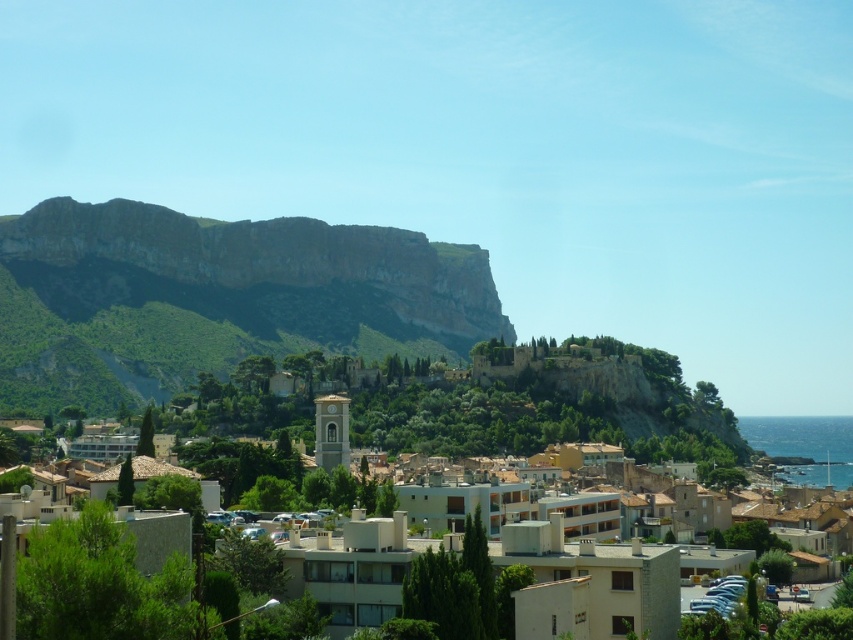
Who is shorter, beige stone town at center or smooth stone bell tower at center?

With less height is smooth stone bell tower at center.

Who is positioned more to the left, beige stone town at center or smooth stone bell tower at center?

smooth stone bell tower at center

At what (x,y) coordinates should I click in order to perform the action: click on beige stone town at center. Please return your answer as a coordinate pair (x, y). The height and width of the screenshot is (640, 853). Looking at the image, I should click on (590, 582).

Does rugged stone cliff at left have a larger size compared to beige stone town at center?

Yes.

Is point (228, 221) positioned behind point (355, 573)?

Yes.

The height and width of the screenshot is (640, 853). In order to click on rugged stone cliff at left in this screenshot , I will do `click(213, 298)`.

Can you confirm if rugged stone cliff at left is positioned to the left of smooth stone bell tower at center?

Yes, rugged stone cliff at left is to the left of smooth stone bell tower at center.

Does point (3, 397) come closer to viewer compared to point (347, 451)?

No, it is behind (347, 451).

Does point (77, 227) come closer to viewer compared to point (328, 458)?

That is False.

This screenshot has height=640, width=853. What are the coordinates of `rugged stone cliff at left` in the screenshot? It's located at (213, 298).